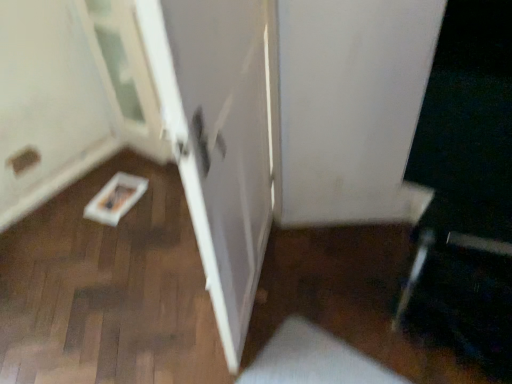
Where is `free spot in front of white glossy door at center`? free spot in front of white glossy door at center is located at coordinates (266, 344).